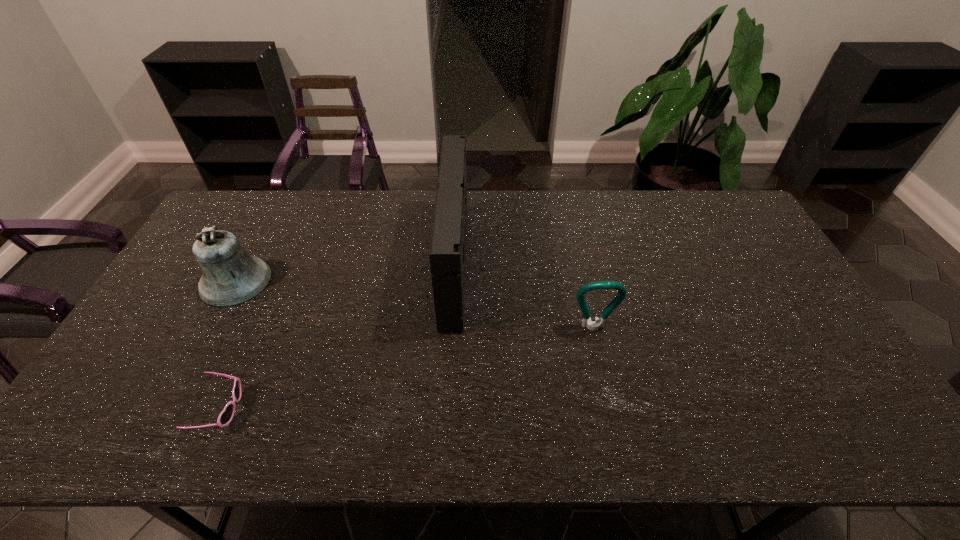
Image resolution: width=960 pixels, height=540 pixels. What are the coordinates of `empty space between the bottle opener and the tallest object` in the screenshot? It's located at (524, 296).

The width and height of the screenshot is (960, 540). Find the location of `free spot between the shortest object and the rightmost object`. free spot between the shortest object and the rightmost object is located at coordinates (407, 368).

What are the coordinates of `free area in between the bell and the nearest object` in the screenshot? It's located at (228, 345).

Identify the location of free space between the bottle opener and the bell. The image size is (960, 540). (415, 305).

Where is `vacant space that's between the videotape and the nearest object`? Image resolution: width=960 pixels, height=540 pixels. vacant space that's between the videotape and the nearest object is located at coordinates (338, 336).

Where is `vacant area that lies between the nearest object and the videotape`? This screenshot has height=540, width=960. vacant area that lies between the nearest object and the videotape is located at coordinates (338, 336).

Locate an element on the screen. The image size is (960, 540). vacant space that's between the videotape and the rightmost object is located at coordinates (524, 296).

The height and width of the screenshot is (540, 960). I want to click on free point between the bell and the videotape, so click(x=346, y=273).

Locate an element on the screen. free space that is in between the tallest object and the bell is located at coordinates [346, 273].

The width and height of the screenshot is (960, 540). What are the coordinates of `vacant point located between the tallest object and the bell` in the screenshot? It's located at (346, 273).